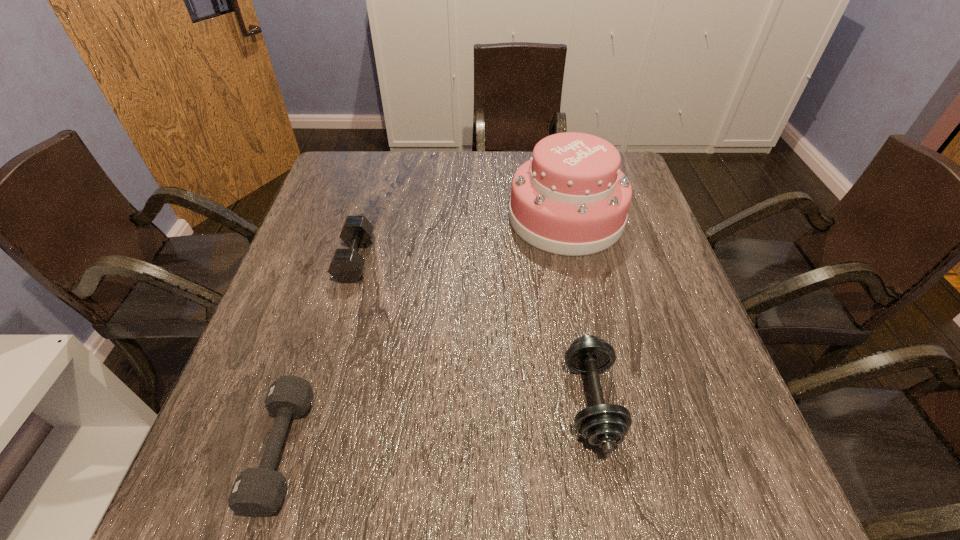
Where is `cake`? This screenshot has width=960, height=540. cake is located at coordinates (571, 198).

The image size is (960, 540). I want to click on the tallest dumbbell, so click(x=604, y=425).

Find the location of a particular element. The height and width of the screenshot is (540, 960). the rightmost dumbbell is located at coordinates (604, 425).

Where is `the farthest dumbbell`? The height and width of the screenshot is (540, 960). the farthest dumbbell is located at coordinates (346, 266).

Where is `free point located on the left of the cake`? The width and height of the screenshot is (960, 540). free point located on the left of the cake is located at coordinates (487, 218).

Where is `blank space located on the right of the second tallest object`? The height and width of the screenshot is (540, 960). blank space located on the right of the second tallest object is located at coordinates (719, 401).

I want to click on free point located 0.090m on the left of the farthest dumbbell, so click(302, 260).

At what (x,y) coordinates should I click in order to perform the action: click on object that is positioned at the far edge. Please return your answer as a coordinate pair (x, y). The width and height of the screenshot is (960, 540). Looking at the image, I should click on (571, 198).

This screenshot has width=960, height=540. What are the coordinates of `object at the near edge` in the screenshot? It's located at (257, 492).

Identify the location of object that is positioned at the right edge. (571, 198).